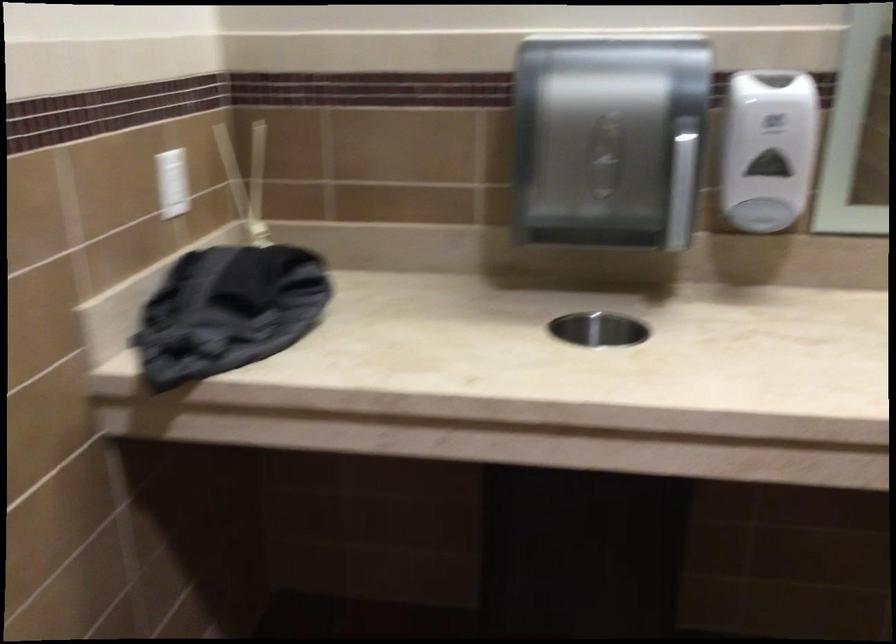
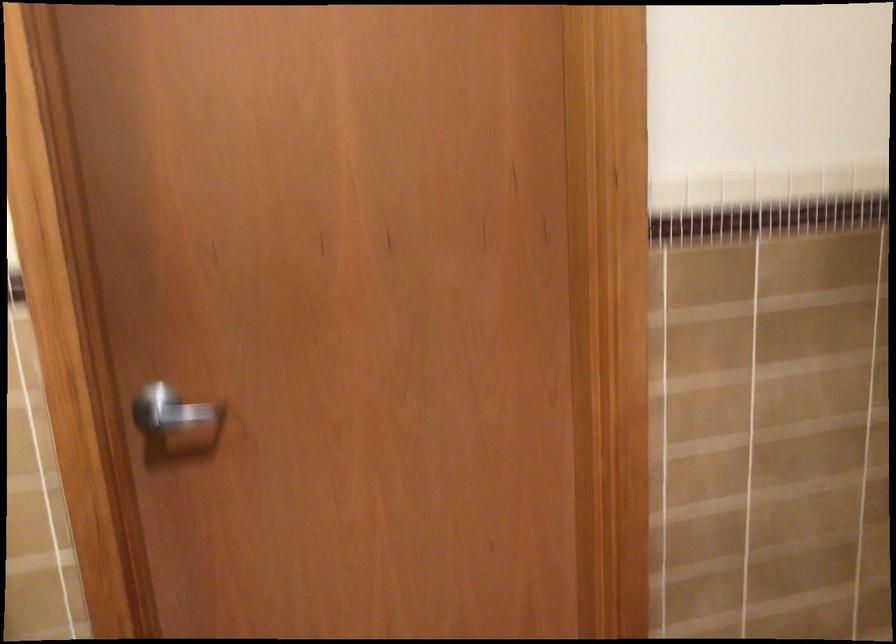
The first image is from the beginning of the video and the second image is from the end. How did the camera likely rotate when shooting the video?

The camera rotated toward right-down.